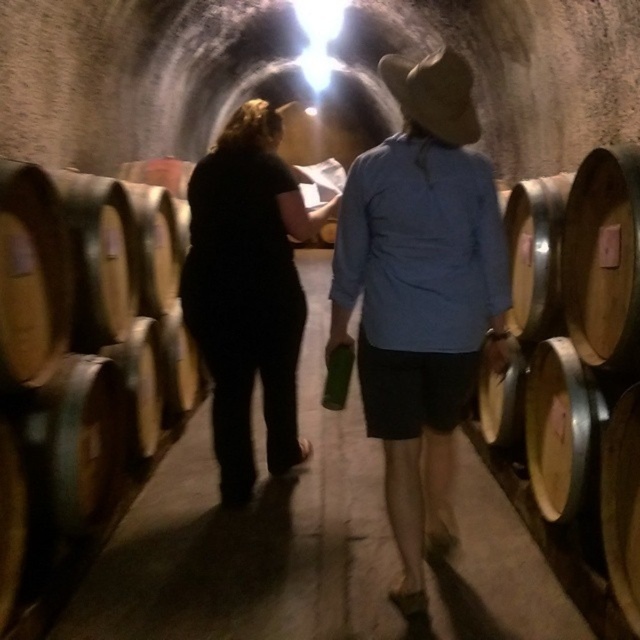
Question: Among these objects, which one is nearest to the camera?

Choices:
 (A) black matte pants at center
 (B) wooden barrel at right

Answer: (B)

Question: Can you confirm if wooden barrel at left is thinner than matte black shirt at center?

Choices:
 (A) no
 (B) yes

Answer: (B)

Question: Is matte black shirt at center further to the viewer compared to black matte pants at center?

Choices:
 (A) no
 (B) yes

Answer: (A)

Question: Which point is closer to the camera?

Choices:
 (A) (467, 164)
 (B) (545, 540)
 (C) (300, 195)
 (D) (32, 486)

Answer: (A)

Question: Which is nearer to the wooden barrel at right?

Choices:
 (A) black matte pants at center
 (B) wooden barrel at left

Answer: (A)

Question: Observing the image, what is the correct spatial positioning of wooden barrel at right in reference to black matte pants at center?

Choices:
 (A) left
 (B) right

Answer: (B)